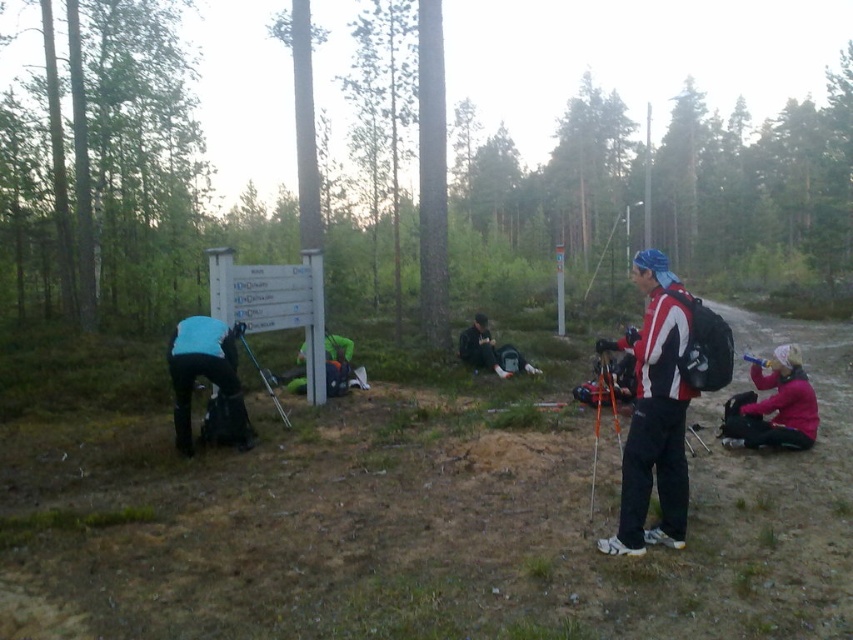
Is red and white ski jacket at right behind pink fleece jacket at lower right?

No, it is in front of pink fleece jacket at lower right.

Can you confirm if red and white ski jacket at right is positioned above pink fleece jacket at lower right?

Indeed, red and white ski jacket at right is positioned over pink fleece jacket at lower right.

What do you see at coordinates (654, 413) in the screenshot? The height and width of the screenshot is (640, 853). I see `red and white ski jacket at right` at bounding box center [654, 413].

In order to click on red and white ski jacket at right in this screenshot , I will do `click(654, 413)`.

Between point (477, 332) and point (257, 365), which one is positioned in front?

Point (257, 365)

Is dark blue jacket at center positioned in front of metallic silver ski pole at lower center?

That is False.

Who is more distant from viewer, (491, 349) or (282, 413)?

The point (491, 349) is more distant.

The image size is (853, 640). In order to click on dark blue jacket at center in this screenshot , I will do tap(479, 346).

Which is more to the right, blue fabric skier at left or dark blue jacket at center?

Positioned to the right is dark blue jacket at center.

Is point (219, 355) closer to camera compared to point (495, 358)?

Yes.

Who is more distant from viewer, (x=193, y=321) or (x=502, y=371)?

Positioned behind is point (x=502, y=371).

Image resolution: width=853 pixels, height=640 pixels. Find the location of `blue fabric skier at left`. blue fabric skier at left is located at coordinates (206, 376).